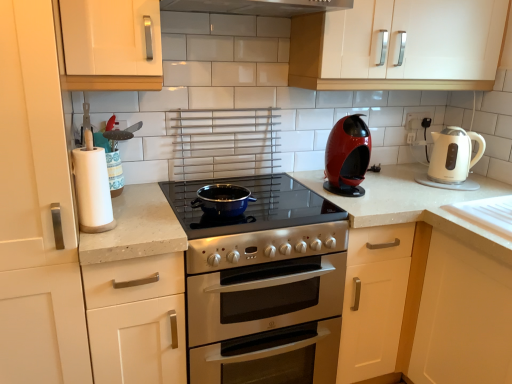
Identify the location of free space in front of white matte paper towel at left. The width and height of the screenshot is (512, 384). (101, 235).